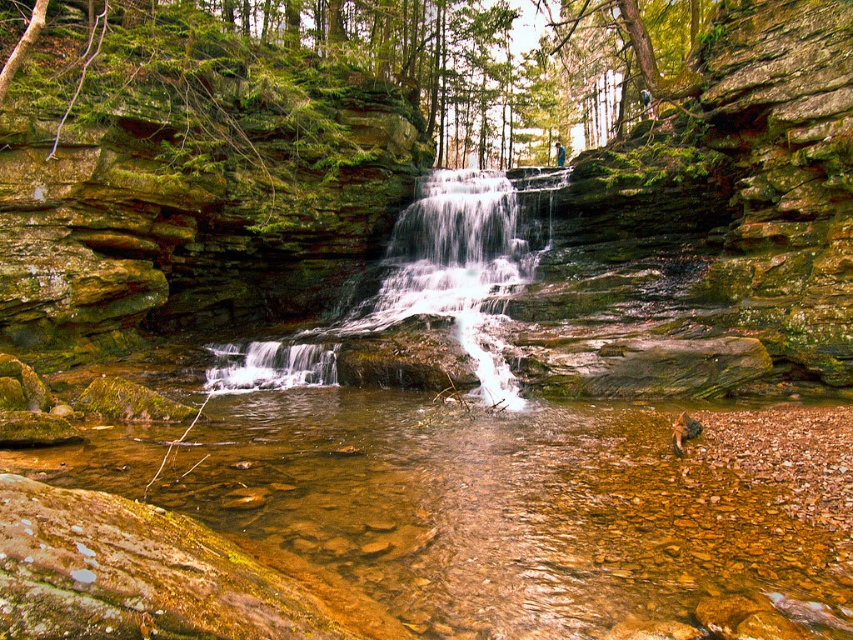
Question: Among these points, which one is farthest from the camera?

Choices:
 (A) (561, 170)
 (B) (296, 612)

Answer: (A)

Question: Is clear water at center below translucent glass waterfall at center?

Choices:
 (A) yes
 (B) no

Answer: (A)

Question: Is clear water at center positioned before translucent glass waterfall at center?

Choices:
 (A) yes
 (B) no

Answer: (A)

Question: Can you confirm if clear water at center is smaller than translucent glass waterfall at center?

Choices:
 (A) no
 (B) yes

Answer: (B)